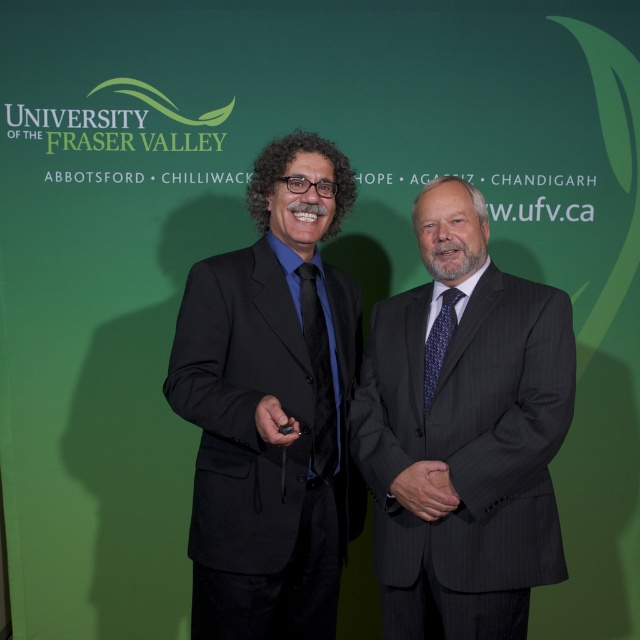
Question: Does matte black tie at center have a smaller size compared to blue textured tie at center?

Choices:
 (A) yes
 (B) no

Answer: (B)

Question: Among these objects, which one is nearest to the camera?

Choices:
 (A) black matte suit at center
 (B) blue textured tie at center

Answer: (A)

Question: Can you confirm if dark gray pinstripe suit at center is smaller than black matte suit at center?

Choices:
 (A) no
 (B) yes

Answer: (B)

Question: Among these objects, which one is farthest from the camera?

Choices:
 (A) blue textured tie at center
 (B) matte black tie at center

Answer: (B)

Question: Does dark gray pinstripe suit at center come in front of black matte suit at center?

Choices:
 (A) no
 (B) yes

Answer: (A)

Question: Which point is farther from the camera taking this photo?

Choices:
 (A) (502, 435)
 (B) (317, 461)
 (C) (442, 324)
 (D) (252, 538)

Answer: (C)